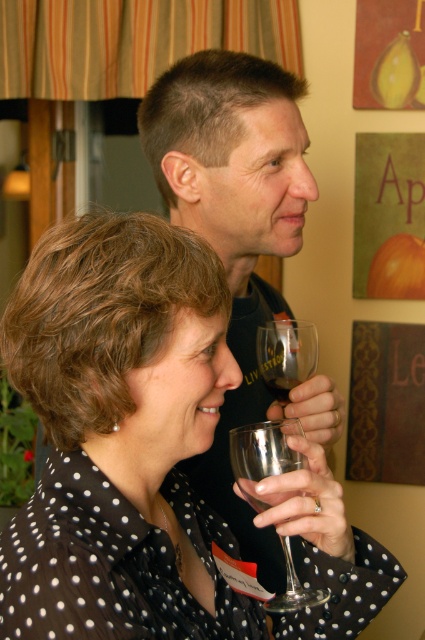
Question: Is matte black shirt at upper center further to camera compared to clear glass wine glass at center?

Choices:
 (A) no
 (B) yes

Answer: (B)

Question: Is black dotted shirt at center closer to the viewer compared to clear glass wine glass at center?

Choices:
 (A) no
 (B) yes

Answer: (B)

Question: Does black dotted shirt at center have a larger size compared to clear glass wine at center?

Choices:
 (A) no
 (B) yes

Answer: (B)

Question: Which point is closer to the camera?

Choices:
 (A) (280, 432)
 (B) (104, 440)
 (C) (294, 378)
 (D) (192, 84)

Answer: (B)

Question: Among these objects, which one is farthest from the camera?

Choices:
 (A) clear glass wine at center
 (B) black dotted shirt at center

Answer: (A)

Question: Among these objects, which one is farthest from the camera?

Choices:
 (A) matte black shirt at upper center
 (B) black dotted shirt at center
 (C) clear glass wine at center
 (D) clear glass wine glass at center

Answer: (C)